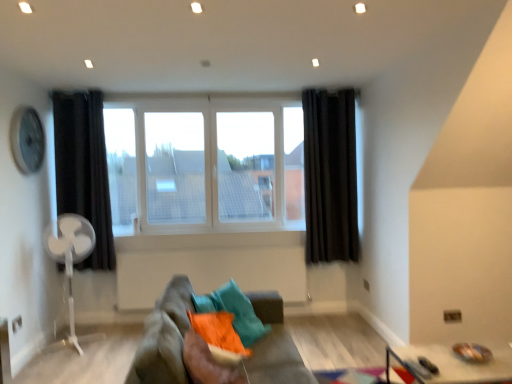
Question: Is white plastic fan at left taller than white glass window at center?

Choices:
 (A) no
 (B) yes

Answer: (A)

Question: Is white plastic fan at left closer to camera compared to white glass window at center?

Choices:
 (A) no
 (B) yes

Answer: (B)

Question: Is white plastic fan at left wider than white glass window at center?

Choices:
 (A) yes
 (B) no

Answer: (A)

Question: Is white plastic fan at left with white glass window at center?

Choices:
 (A) no
 (B) yes

Answer: (A)

Question: Is white plastic fan at left completely or partially outside of white glass window at center?

Choices:
 (A) no
 (B) yes

Answer: (B)

Question: Is white plastic fan at left turned away from white glass window at center?

Choices:
 (A) yes
 (B) no

Answer: (B)

Question: Is metallic silver tray at lower right positioned with its back to metallic silver clock at upper left?

Choices:
 (A) yes
 (B) no

Answer: (B)

Question: From a real-world perspective, does metallic silver tray at lower right sit lower than metallic silver clock at upper left?

Choices:
 (A) yes
 (B) no

Answer: (A)

Question: Is metallic silver tray at lower right closer to the viewer compared to metallic silver clock at upper left?

Choices:
 (A) no
 (B) yes

Answer: (B)

Question: Considering the relative sizes of metallic silver tray at lower right and metallic silver clock at upper left in the image provided, is metallic silver tray at lower right smaller than metallic silver clock at upper left?

Choices:
 (A) yes
 (B) no

Answer: (B)

Question: Considering the relative sizes of metallic silver tray at lower right and metallic silver clock at upper left in the image provided, is metallic silver tray at lower right wider than metallic silver clock at upper left?

Choices:
 (A) yes
 (B) no

Answer: (A)

Question: Could metallic silver clock at upper left be considered to be inside metallic silver tray at lower right?

Choices:
 (A) no
 (B) yes

Answer: (A)

Question: From a real-world perspective, is black fabric curtain at right, the 1th curtain in the right-to-left sequence, positioned under metallic silver tray at lower right based on gravity?

Choices:
 (A) no
 (B) yes

Answer: (A)